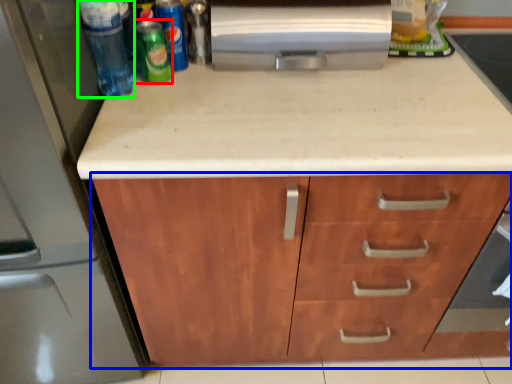
Question: Estimate the real-world distances between objects in this image. Which object is closer to beer (highlighted by a red box), cabinetry (highlighted by a blue box) or beverage (highlighted by a green box)?

Choices:
 (A) cabinetry
 (B) beverage

Answer: (B)